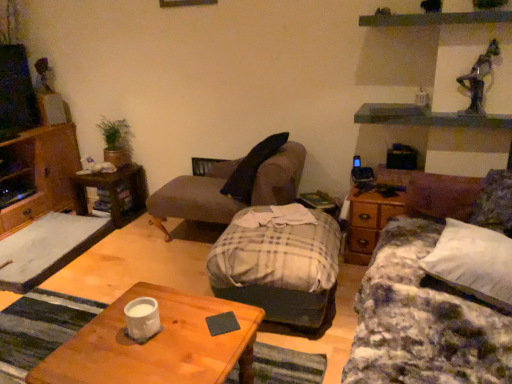
Question: Is plaid fabric studio couch at center, which is counted as the 2th studio couch, starting from the right, positioned before plaid fabric studio couch at center, marked as the second studio couch in a left-to-right arrangement?

Choices:
 (A) no
 (B) yes

Answer: (A)

Question: From the image's perspective, is plaid fabric studio couch at center, which is counted as the 2th studio couch, starting from the right, located above plaid fabric studio couch at center, the first studio couch in the right-to-left sequence?

Choices:
 (A) yes
 (B) no

Answer: (A)

Question: Is plaid fabric studio couch at center, which is the 1th studio couch in left-to-right order, at the right side of plaid fabric studio couch at center, marked as the second studio couch in a left-to-right arrangement?

Choices:
 (A) no
 (B) yes

Answer: (A)

Question: Does plaid fabric studio couch at center, which is the 1th studio couch in left-to-right order, have a greater width compared to plaid fabric studio couch at center, the first studio couch in the right-to-left sequence?

Choices:
 (A) no
 (B) yes

Answer: (A)

Question: Is plaid fabric studio couch at center, which is counted as the 2th studio couch, starting from the right, bigger than plaid fabric studio couch at center, marked as the second studio couch in a left-to-right arrangement?

Choices:
 (A) yes
 (B) no

Answer: (B)

Question: From the image's perspective, is wooden side table at right positioned above or below white soft pillow at right?

Choices:
 (A) above
 (B) below

Answer: (A)

Question: Which is correct: wooden side table at right is inside white soft pillow at right, or outside of it?

Choices:
 (A) outside
 (B) inside

Answer: (A)

Question: In terms of height, does wooden side table at right look taller or shorter compared to white soft pillow at right?

Choices:
 (A) tall
 (B) short

Answer: (A)

Question: Is wooden side table at right in front of or behind white soft pillow at right in the image?

Choices:
 (A) front
 (B) behind

Answer: (B)

Question: Based on their sizes in the image, would you say wooden side table at right is bigger or smaller than plaid fabric studio couch at center, which is the 1th studio couch in left-to-right order?

Choices:
 (A) big
 (B) small

Answer: (B)

Question: In the image, is wooden side table at right positioned in front of or behind plaid fabric studio couch at center, which is counted as the 2th studio couch, starting from the right?

Choices:
 (A) behind
 (B) front

Answer: (A)

Question: Which is correct: wooden side table at right is inside plaid fabric studio couch at center, which is the 1th studio couch in left-to-right order, or outside of it?

Choices:
 (A) inside
 (B) outside

Answer: (B)

Question: From the image's perspective, relative to plaid fabric studio couch at center, which is the 1th studio couch in left-to-right order, is wooden side table at right above or below?

Choices:
 (A) above
 (B) below

Answer: (A)

Question: Relative to plush brown chaise at center, is white matte coffee cup at lower left in front or behind?

Choices:
 (A) behind
 (B) front

Answer: (B)

Question: Considering the positions of white matte coffee cup at lower left and plush brown chaise at center in the image, is white matte coffee cup at lower left taller or shorter than plush brown chaise at center?

Choices:
 (A) short
 (B) tall

Answer: (A)